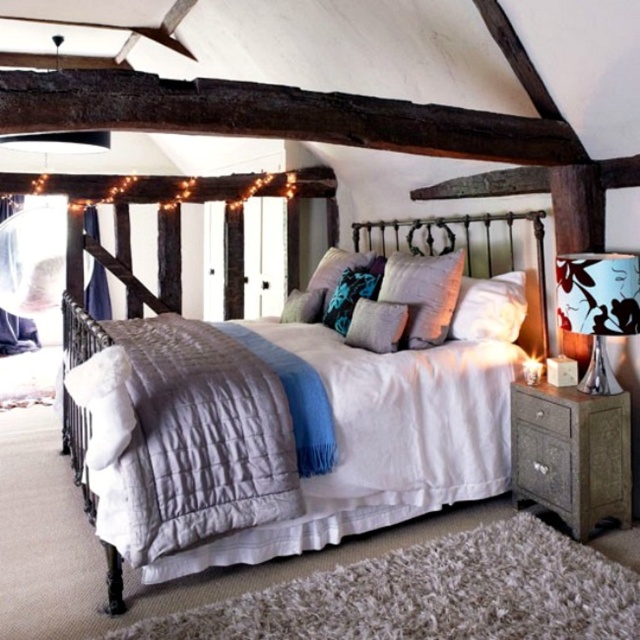
In the scene shown: You are arranging a photo shoot in this bedroom and need to place a rectangular box that is 10 cm thick. You have to decide between placing it under the blue fabric lampshade at right or on top of the white soft pillow at center. Based on their thickness, which object can accommodate the box without it sticking out?

The blue fabric lampshade at right is thinner than the white soft pillow at center, so the box cannot fit under the lampshade. However, the white soft pillow at center is thicker, which means the 10 cm thick box can be placed on top of it without sticking out.